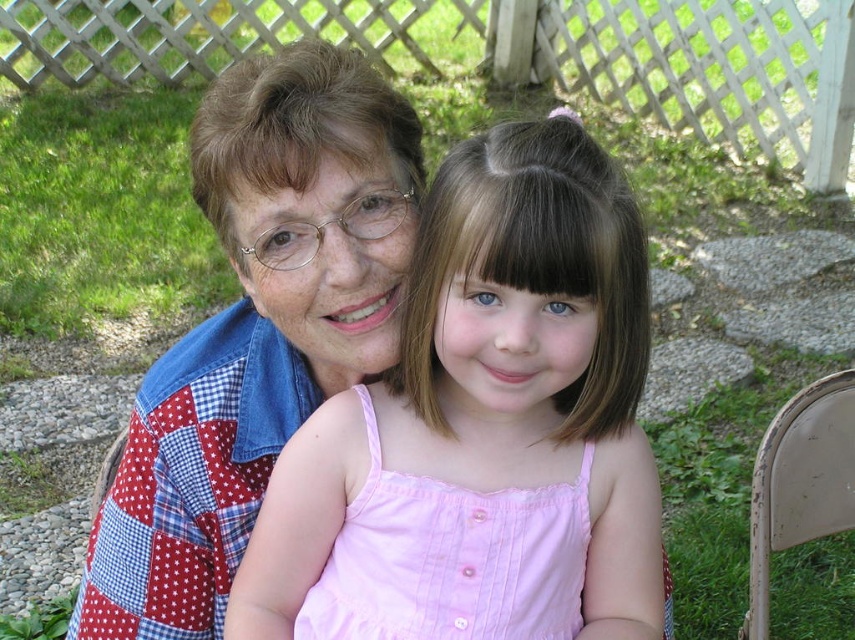
Can you confirm if patchwork quilt at center is positioned to the right of pink cotton dress at center?

In fact, patchwork quilt at center is to the left of pink cotton dress at center.

Who is higher up, patchwork quilt at center or pink cotton dress at center?

Positioned higher is patchwork quilt at center.

Which is in front, point (342, 237) or point (352, 625)?

Point (352, 625) is in front.

Identify the location of patchwork quilt at center. The image size is (855, 640). (257, 328).

Which of these two, pink fabric dress at center or beige plastic chair at lower right, stands shorter?

beige plastic chair at lower right is shorter.

Can you confirm if pink fabric dress at center is bigger than beige plastic chair at lower right?

Correct, pink fabric dress at center is larger in size than beige plastic chair at lower right.

Between point (305, 422) and point (771, 536), which one is positioned behind?

Point (771, 536)

Find the location of `pink fabric dress at center`. pink fabric dress at center is located at coordinates (494, 387).

Is pink cotton dress at center below beige plastic chair at lower right?

Actually, pink cotton dress at center is above beige plastic chair at lower right.

Can you confirm if pink cotton dress at center is taller than beige plastic chair at lower right?

No.

The width and height of the screenshot is (855, 640). What do you see at coordinates (451, 557) in the screenshot? I see `pink cotton dress at center` at bounding box center [451, 557].

You are a GUI agent. You are given a task and a screenshot of the screen. Output one action in this format:
    pyautogui.click(x=<x>, y=<y>)
    Task: Click on the pink cotton dress at center
    The height and width of the screenshot is (640, 855).
    Given the screenshot: What is the action you would take?
    pyautogui.click(x=451, y=557)